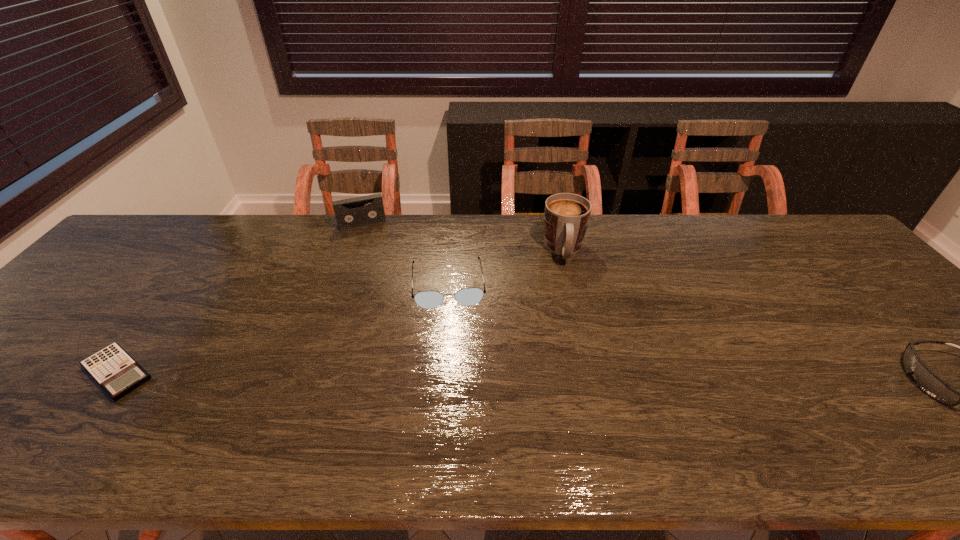
Locate an element on the screen. The height and width of the screenshot is (540, 960). blank area located 0.350m on the side of the fourth object from left to right with the handle is located at coordinates (578, 368).

Image resolution: width=960 pixels, height=540 pixels. Find the location of `vacant space located 0.110m on the lenses of the third object from right to left`. vacant space located 0.110m on the lenses of the third object from right to left is located at coordinates (452, 342).

Identify the location of free space located on the lenses of the third object from right to left. (455, 376).

Where is `vacant space located on the lenses of the third object from right to left`? The width and height of the screenshot is (960, 540). vacant space located on the lenses of the third object from right to left is located at coordinates point(455,376).

This screenshot has width=960, height=540. I want to click on free space located 0.340m on the front-facing side of the farthest object, so click(388, 298).

You are a GUI agent. You are given a task and a screenshot of the screen. Output one action in this format:
    pyautogui.click(x=<x>, y=<y>)
    Task: Click on the vacant space located on the front-facing side of the farthest object
    Image resolution: width=960 pixels, height=540 pixels.
    Given the screenshot: What is the action you would take?
    pyautogui.click(x=377, y=263)

Locate an element on the screen. This screenshot has width=960, height=540. vacant region located 0.090m on the front-facing side of the farthest object is located at coordinates (372, 246).

Where is `mug that is at the far edge`? mug that is at the far edge is located at coordinates (566, 216).

Find the location of a particular element. videotape that is at the far edge is located at coordinates (353, 212).

Find the location of a particular element. This screenshot has height=540, width=960. object that is at the near edge is located at coordinates (118, 374).